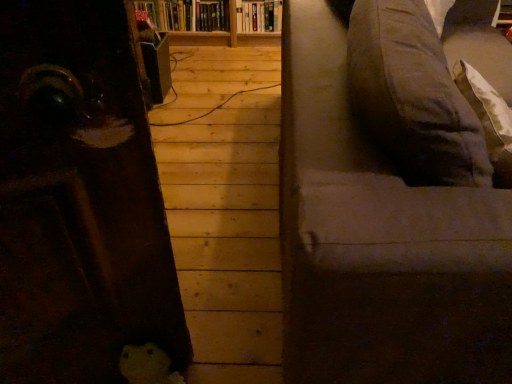
Question: Looking at the image, does hardcover book at upper center, which is the second book from right to left, seem bigger or smaller compared to hardcover book at upper center, positioned as the 2th book in left-to-right order?

Choices:
 (A) big
 (B) small

Answer: (A)

Question: From the image's perspective, is hardcover book at upper center, which is the first book from left to right, above or below hardcover book at upper center, positioned as the 2th book in left-to-right order?

Choices:
 (A) above
 (B) below

Answer: (A)

Question: Estimate the real-world distances between objects in this image. Which object is closer to the hardcover book at upper center, which is the first book from left to right?

Choices:
 (A) hardcover book at upper center, positioned as the 2th book in left-to-right order
 (B) dark gray fabric couch at right

Answer: (A)

Question: Which object is positioned closest to the hardcover book at upper center, which is the first book from left to right?

Choices:
 (A) hardcover book at upper center, which is the 1th book from right to left
 (B) dark gray fabric couch at right

Answer: (A)